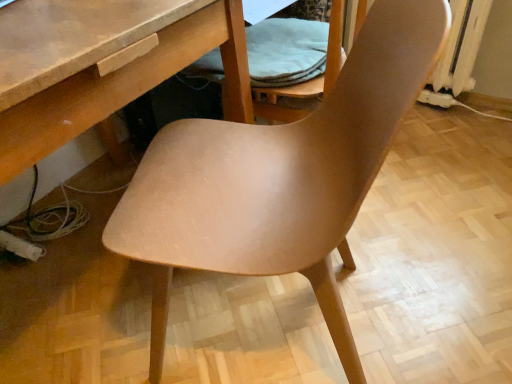
Question: Is matte wood chair at center bigger or smaller than light brown wood folding chair at center?

Choices:
 (A) big
 (B) small

Answer: (A)

Question: Considering the positions of point (331, 324) and point (305, 86), is point (331, 324) closer or farther from the camera than point (305, 86)?

Choices:
 (A) farther
 (B) closer

Answer: (B)

Question: From a real-world perspective, is matte wood chair at center positioned above or below light brown wood folding chair at center?

Choices:
 (A) above
 (B) below

Answer: (B)

Question: From the image's perspective, is light brown wood folding chair at center positioned above or below matte wood chair at center?

Choices:
 (A) below
 (B) above

Answer: (B)

Question: From a real-world perspective, is light brown wood folding chair at center above or below matte wood chair at center?

Choices:
 (A) below
 (B) above

Answer: (B)

Question: In the image, is light brown wood folding chair at center positioned in front of or behind matte wood chair at center?

Choices:
 (A) front
 (B) behind

Answer: (B)

Question: Looking at their shapes, would you say light brown wood folding chair at center is wider or thinner than matte wood chair at center?

Choices:
 (A) thin
 (B) wide

Answer: (A)